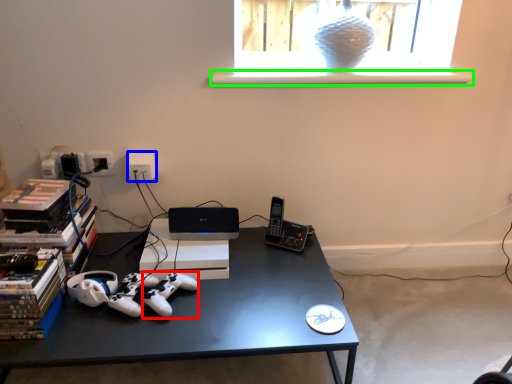
Question: Which is nearer to the game controller (highlighted by a red box)? electric outlet (highlighted by a blue box) or window sill (highlighted by a green box).

Choices:
 (A) electric outlet
 (B) window sill

Answer: (A)